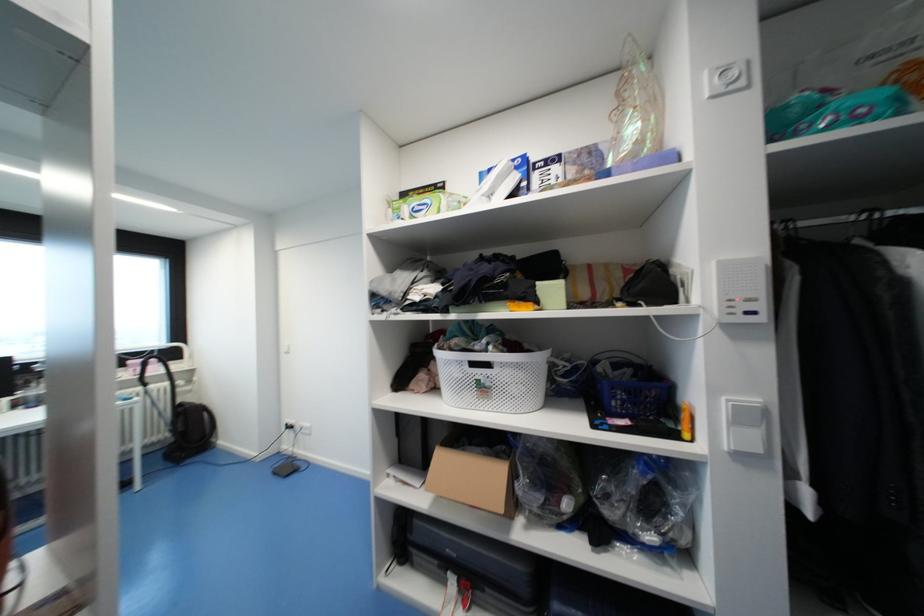
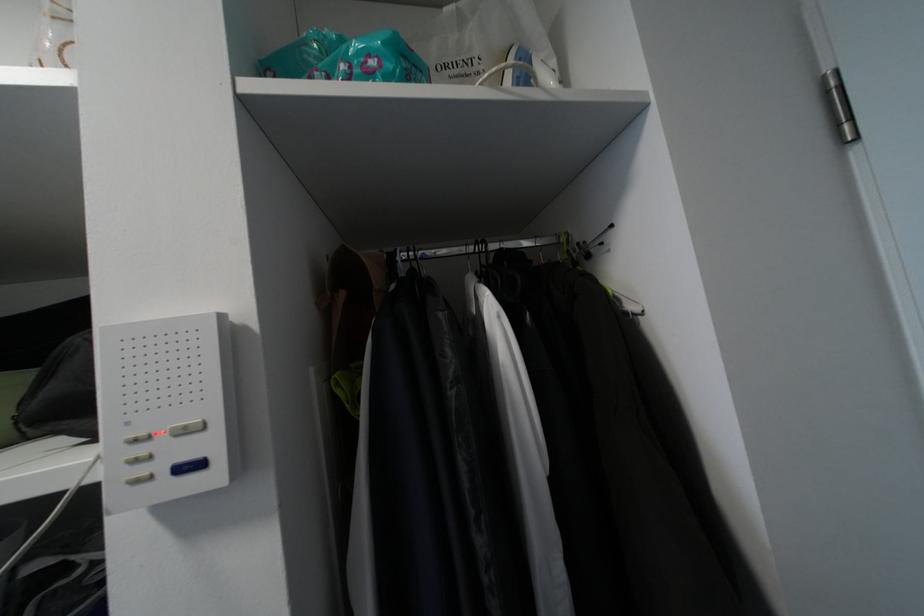
Question: The images are taken continuously from a first-person perspective. In which direction is your viewpoint rotating?

Choices:
 (A) Left
 (B) Right
 (C) Up
 (D) Down

Answer: (B)